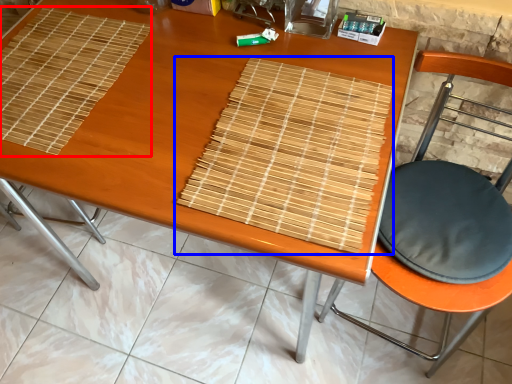
Question: Which object appears farthest to the camera in this image, mat (highlighted by a red box) or mat (highlighted by a blue box)?

Choices:
 (A) mat
 (B) mat

Answer: (A)